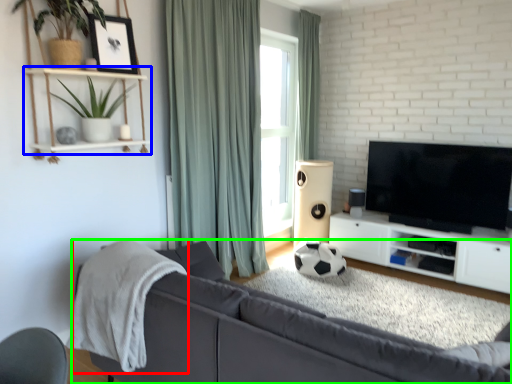
Question: Based on their relative distances, which object is farther from blanket (highlighted by a red box)? Choose from shelf (highlighted by a blue box) and studio couch (highlighted by a green box).

Choices:
 (A) shelf
 (B) studio couch

Answer: (A)